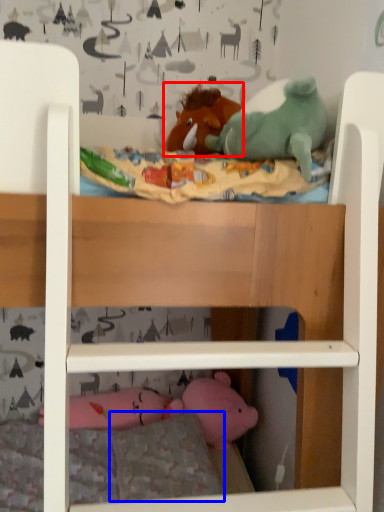
Question: Which of the following is the farthest to the observer, toy (highlighted by a red box) or pillow (highlighted by a blue box)?

Choices:
 (A) toy
 (B) pillow

Answer: (A)